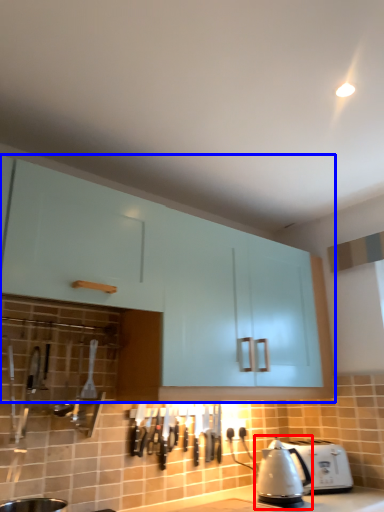
Question: Which point is closer to the camera, kettle (highlighted by a red box) or cabinetry (highlighted by a blue box)?

Choices:
 (A) kettle
 (B) cabinetry

Answer: (B)